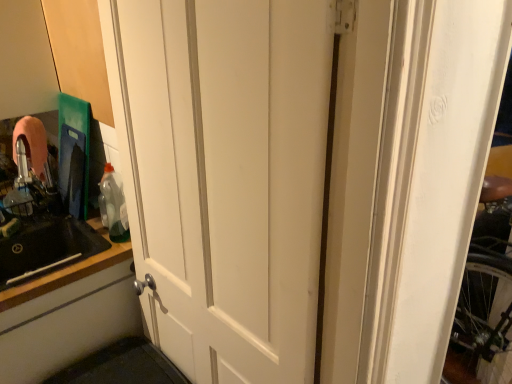
Question: Is black matte sink at left wider or thinner than black matte countertop at left?

Choices:
 (A) wide
 (B) thin

Answer: (A)

Question: Is point (74, 253) positioned closer to the camera than point (1, 311)?

Choices:
 (A) farther
 (B) closer

Answer: (A)

Question: Considering the real-world distances, which object is closest to the black matte countertop at left?

Choices:
 (A) black matte sink at left
 (B) translucent plastic bottle at left
 (C) white matte cabinet door at lower left

Answer: (C)

Question: Estimate the real-world distances between objects in this image. Which object is farther from the translucent plastic bottle at left?

Choices:
 (A) black matte sink at left
 (B) black matte countertop at left
 (C) white matte cabinet door at lower left

Answer: (C)